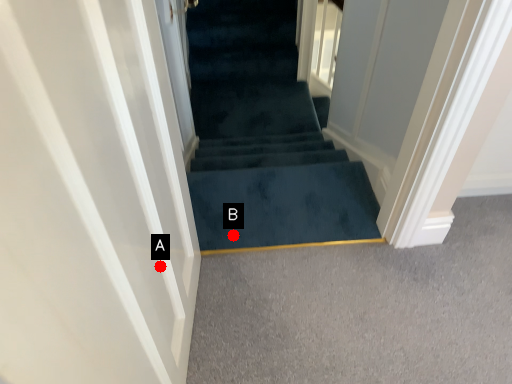
Question: Two points are circled on the image, labeled by A and B beside each circle. Which of the following is the farthest from the observer?

Choices:
 (A) A is further
 (B) B is further

Answer: (B)